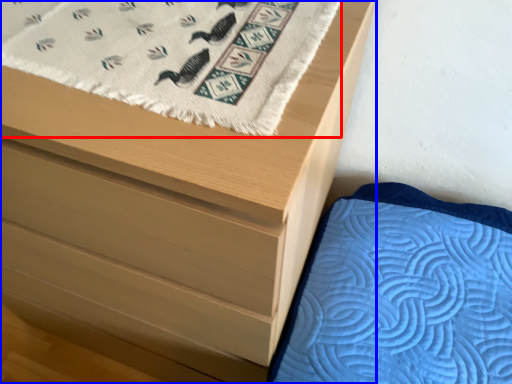
Question: Which object appears closest to the camera in this image, blanket (highlighted by a red box) or chest of drawers (highlighted by a blue box)?

Choices:
 (A) blanket
 (B) chest of drawers

Answer: (B)